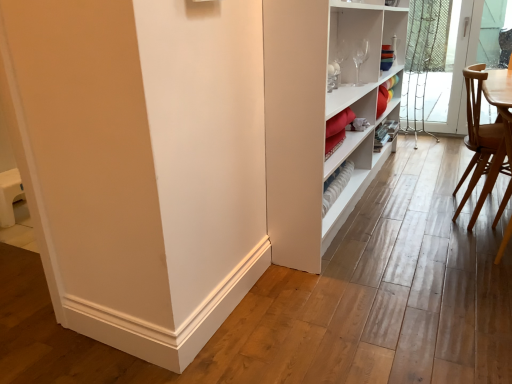
Locate an element on the screen. vacant area on top of clear glass screen door at right (from a real-world perspective) is located at coordinates (439, 0).